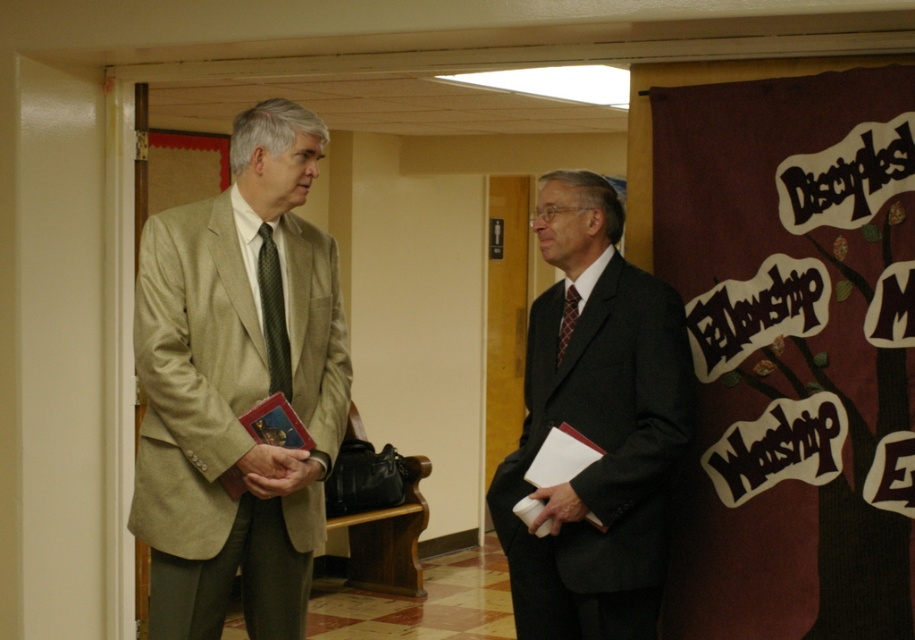
Question: Estimate the real-world distances between objects in this image. Which object is closer to the dark gray suit at center?

Choices:
 (A) matte beige suit at left
 (B) green textured tie at left
 (C) dark red textured tie at right

Answer: (C)

Question: Among these objects, which one is farthest from the camera?

Choices:
 (A) green textured tie at left
 (B) dark gray suit at center

Answer: (A)

Question: Can you confirm if green textured tie at left is positioned below dark red textured tie at right?

Choices:
 (A) yes
 (B) no

Answer: (B)

Question: Does dark gray suit at center appear under dark red textured tie at right?

Choices:
 (A) no
 (B) yes

Answer: (B)

Question: Can you confirm if green textured tie at left is smaller than dark red textured tie at right?

Choices:
 (A) no
 (B) yes

Answer: (A)

Question: Among these objects, which one is nearest to the camera?

Choices:
 (A) dark gray suit at center
 (B) green textured tie at left
 (C) matte beige suit at left

Answer: (C)